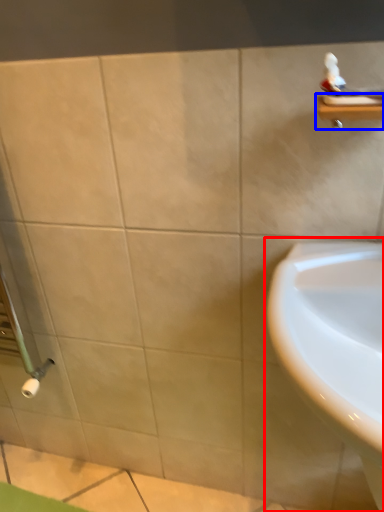
Question: Which object appears farthest to the camera in this image, sink (highlighted by a red box) or balustrade (highlighted by a blue box)?

Choices:
 (A) sink
 (B) balustrade

Answer: (B)